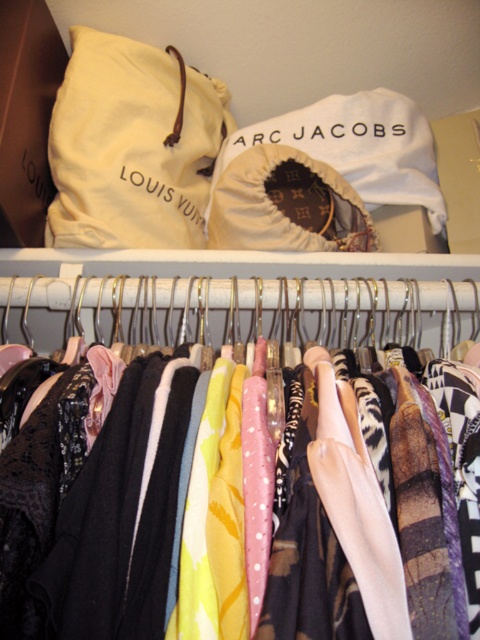
Who is more distant from viewer, (x=197, y=614) or (x=81, y=56)?

The point (x=81, y=56) is more distant.

Measure the distance between silky fabric dresses at center and camera.

silky fabric dresses at center is 16.92 inches away from camera.

Find the location of a particular element. silky fabric dresses at center is located at coordinates (319, 518).